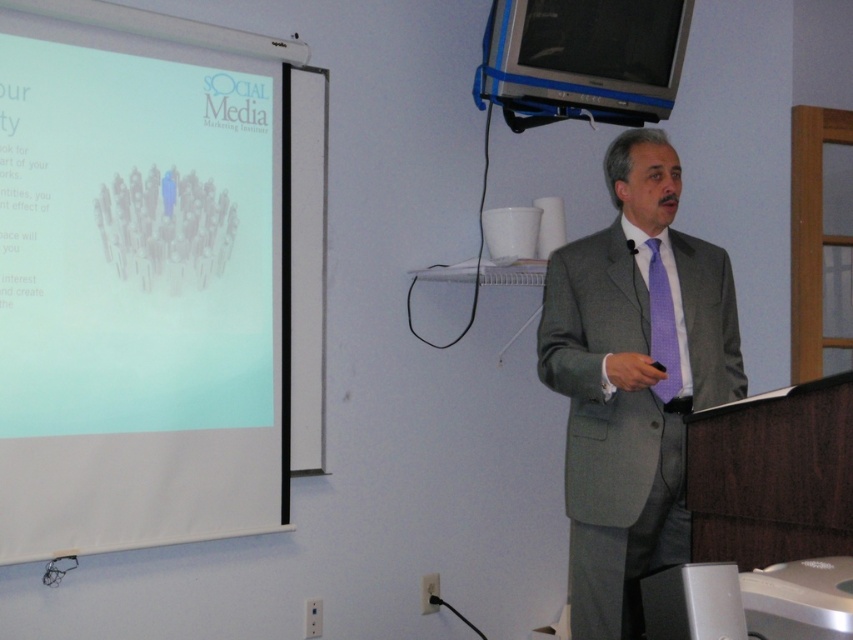
You are a guest speaker in the room. You want to adjust the volume of the satin silver speaker at lower right during your presentation. However, you notice that the white matte projection screen at left is blocking your access to the speaker. Is there a way to reach the speaker without moving the screen?

The satin silver speaker at lower right is behind the white matte projection screen at left, so you can reach it by moving around to the side or back of the screen to access the speaker without needing to move the screen itself.

You are organizing a small meeting and need to place a 1.2 meter wide laptop cart between the white matte projection screen at left and the satin silver speaker at lower right. Can the laptop cart fit between them?

The white matte projection screen at left is wider than the satin silver speaker at lower right. Since the laptop cart is 1.2 meters wide, it depends on the actual distance between the two objects. However, the question only provides information about their widths, not the space between them. Therefore, we cannot determine if the laptop cart will fit based on the given information.